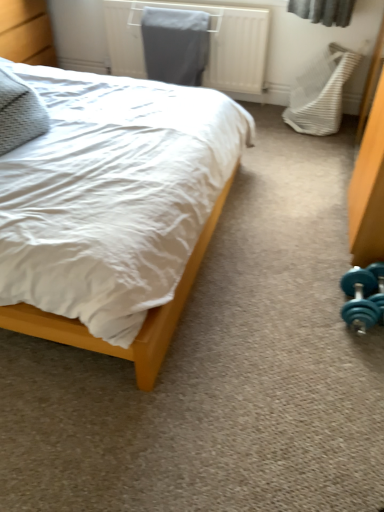
Question: Could you tell me if wooden bed at left is facing textured gray pillow at left?

Choices:
 (A) no
 (B) yes

Answer: (A)

Question: Can you confirm if wooden bed at left is wider than textured gray pillow at left?

Choices:
 (A) yes
 (B) no

Answer: (A)

Question: Does wooden bed at left appear on the right side of textured gray pillow at left?

Choices:
 (A) yes
 (B) no

Answer: (A)

Question: Considering the relative sizes of wooden bed at left and textured gray pillow at left in the image provided, is wooden bed at left bigger than textured gray pillow at left?

Choices:
 (A) yes
 (B) no

Answer: (A)

Question: From the image's perspective, is wooden bed at left above textured gray pillow at left?

Choices:
 (A) no
 (B) yes

Answer: (A)

Question: From a real-world perspective, is wooden bed at left below textured gray pillow at left?

Choices:
 (A) yes
 (B) no

Answer: (A)

Question: Is metallic gray radiator at upper center far from textured gray pillow at left?

Choices:
 (A) yes
 (B) no

Answer: (A)

Question: Does metallic gray radiator at upper center have a larger size compared to textured gray pillow at left?

Choices:
 (A) no
 (B) yes

Answer: (B)

Question: From a real-world perspective, does metallic gray radiator at upper center sit lower than textured gray pillow at left?

Choices:
 (A) yes
 (B) no

Answer: (A)

Question: Is the position of metallic gray radiator at upper center less distant than that of textured gray pillow at left?

Choices:
 (A) yes
 (B) no

Answer: (B)

Question: Is metallic gray radiator at upper center oriented away from textured gray pillow at left?

Choices:
 (A) no
 (B) yes

Answer: (A)

Question: Is metallic gray radiator at upper center further to the viewer compared to textured gray pillow at left?

Choices:
 (A) yes
 (B) no

Answer: (A)

Question: Considering the relative sizes of metallic gray radiator at upper center and white textured swivel chair at right in the image provided, is metallic gray radiator at upper center shorter than white textured swivel chair at right?

Choices:
 (A) yes
 (B) no

Answer: (A)